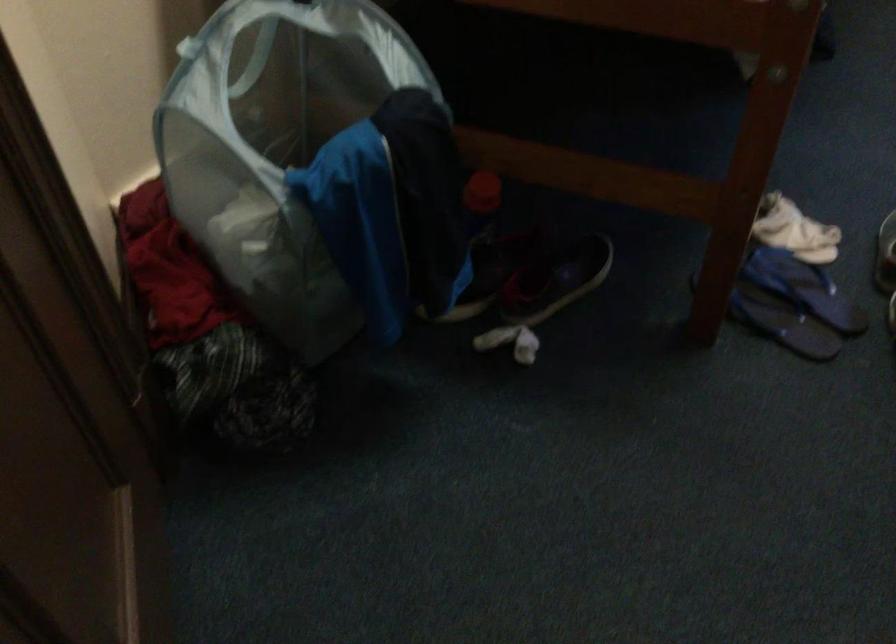
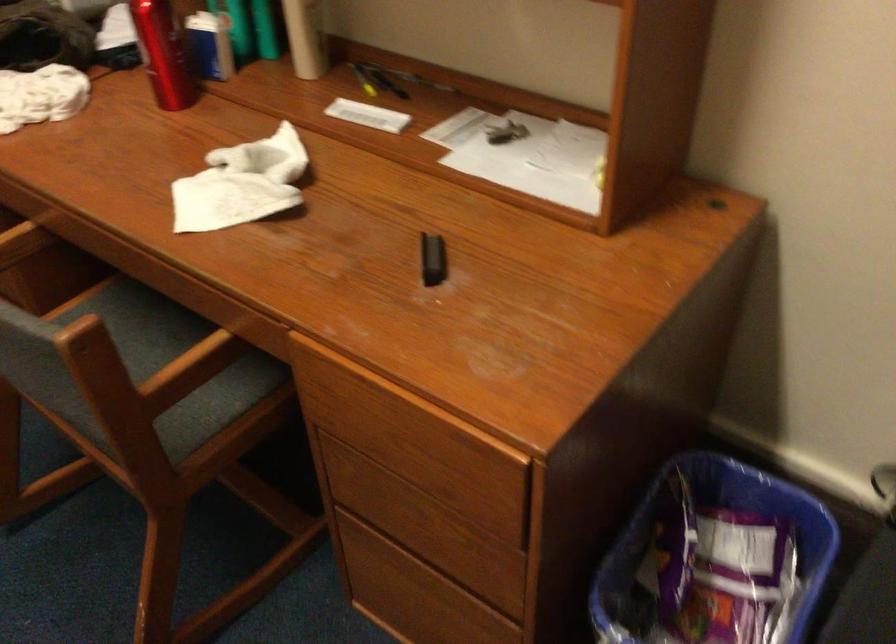
The images are taken continuously from a first-person perspective. In which direction is your viewpoint rotating?

The camera rotated toward right-down.